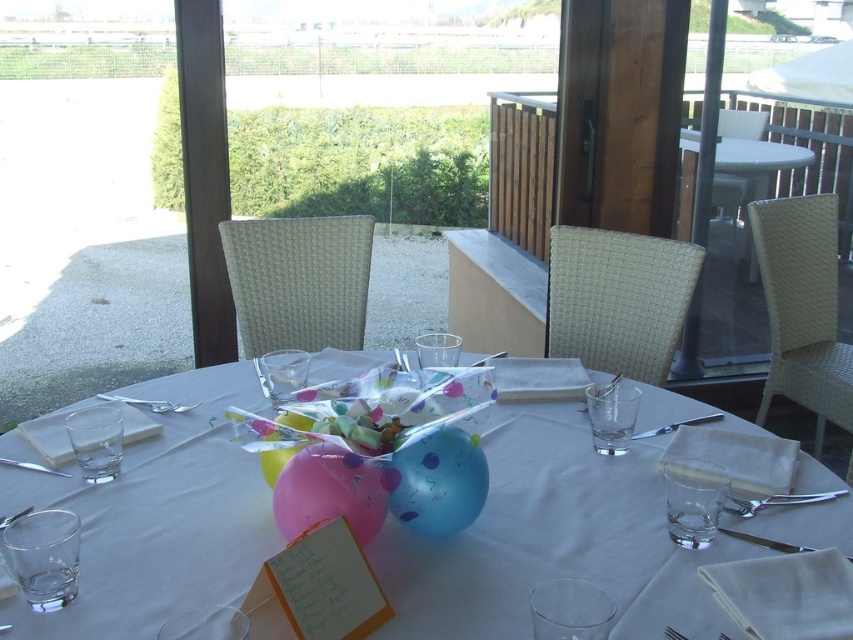
Question: Based on their relative distances, which object is nearer to the translucent glass table at center?

Choices:
 (A) shiny metallic knife at center
 (B) white wicker table at upper right
 (C) satin silver fork at lower right

Answer: (A)

Question: Does satin silver knife at upper center appear on the left side of brushed metal fork at upper left?

Choices:
 (A) yes
 (B) no

Answer: (B)

Question: Which of these objects is positioned farthest from the satin silver fork at lower right?

Choices:
 (A) brushed metal fork at upper left
 (B) translucent glass table at center
 (C) satin silver knife at upper center
 (D) shiny metallic knife at center

Answer: (A)

Question: Does white wicker table at upper right come behind satin silver knife at upper center?

Choices:
 (A) no
 (B) yes

Answer: (B)

Question: Which of the following is the closest to the observer?

Choices:
 (A) shiny metallic knife at center
 (B) satin silver fork at lower right
 (C) white wicker table at upper right
 (D) satin silver knife at upper center

Answer: (B)

Question: Is the position of satin silver fork at lower right less distant than that of satin silver knife at upper center?

Choices:
 (A) yes
 (B) no

Answer: (A)